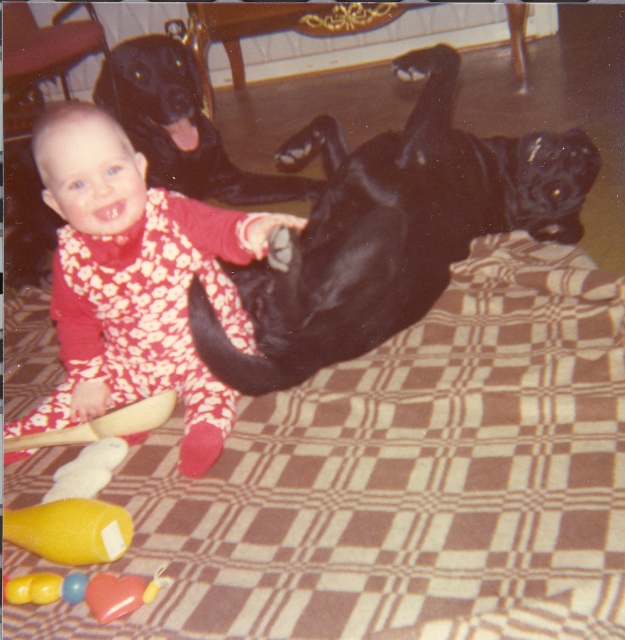
Question: Can you confirm if shiny black dog at center is positioned to the left of rubber heart-shaped toy at lower left?

Choices:
 (A) no
 (B) yes

Answer: (A)

Question: Which object is positioned closest to the shiny black dog at upper center?

Choices:
 (A) shiny black dog at center
 (B) rubber heart-shaped toy at lower left
 (C) floral fabric toddler at center
 (D) yellow rubber rattle at lower left

Answer: (A)

Question: Which point is farther to the camera?

Choices:
 (A) (48, 600)
 (B) (50, 600)

Answer: (B)

Question: Does shiny black dog at center have a lesser width compared to rubberized plastic rattle at lower left?

Choices:
 (A) no
 (B) yes

Answer: (A)

Question: Based on their relative distances, which object is farther from the yellow rubber rattle at lower left?

Choices:
 (A) floral fabric toddler at center
 (B) shiny black dog at upper center
 (C) rubber heart-shaped toy at lower left
 (D) rubberized plastic rattle at lower left

Answer: (B)

Question: Is shiny black dog at center above floral fabric toddler at center?

Choices:
 (A) yes
 (B) no

Answer: (A)